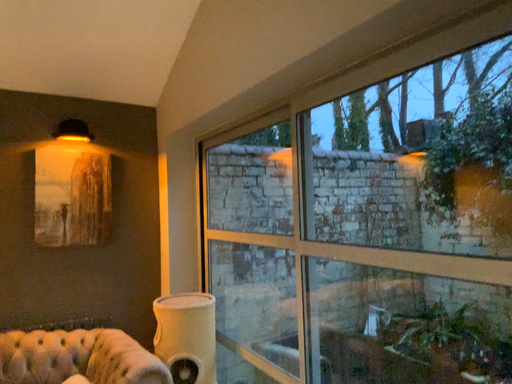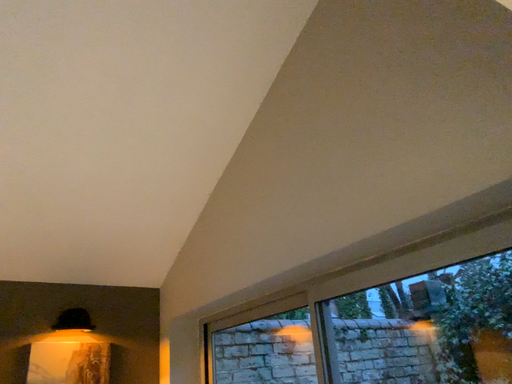
Question: How did the camera likely rotate when shooting the video?

Choices:
 (A) rotated upward
 (B) rotated downward

Answer: (A)